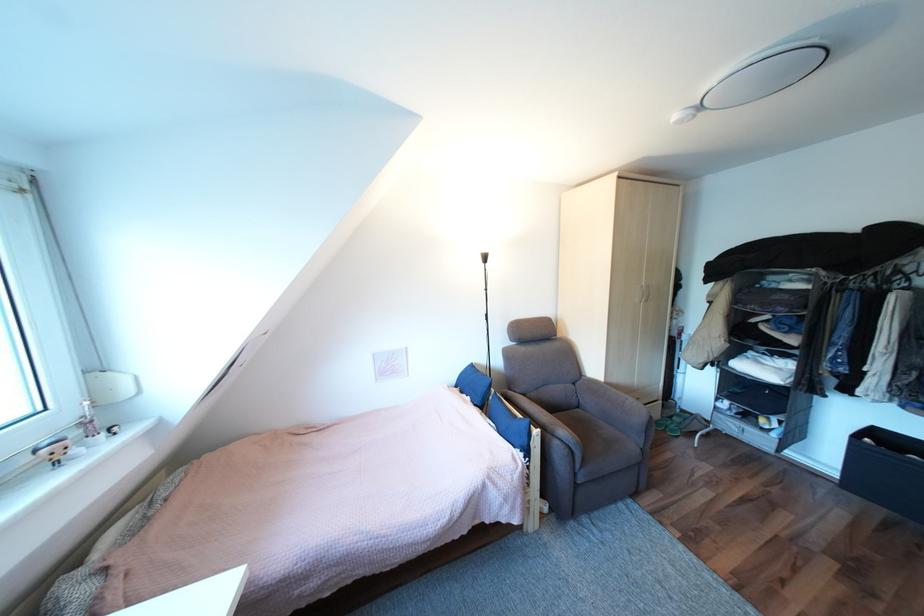
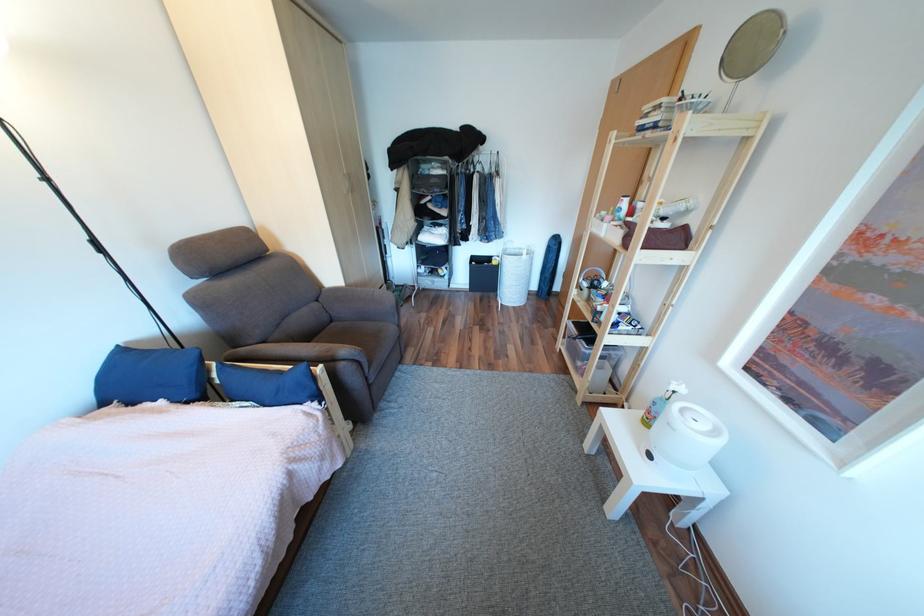
The images are taken continuously from a first-person perspective. In which direction is your viewpoint rotating?

The camera rotated toward right-down.